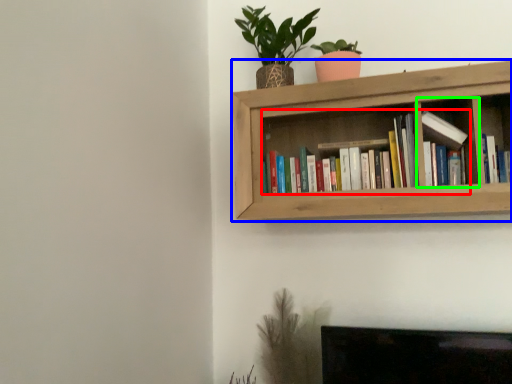
Question: Which object is positioned closest to book (highlighted by a red box)? Select from shelf (highlighted by a blue box) and cabinet (highlighted by a green box).

Choices:
 (A) shelf
 (B) cabinet

Answer: (A)